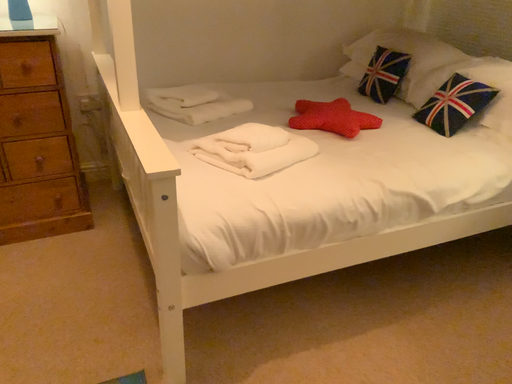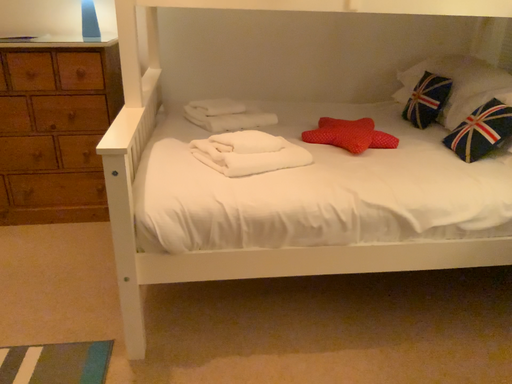
Question: How did the camera likely rotate when shooting the video?

Choices:
 (A) rotated left
 (B) rotated right

Answer: (A)